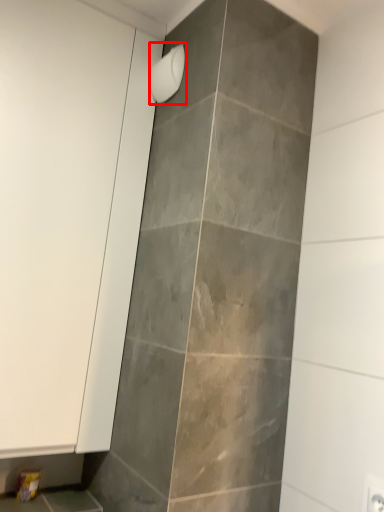
Question: From the image's perspective, where is shower (annotated by the red box) located in relation to screen door in the image?

Choices:
 (A) above
 (B) below

Answer: (A)